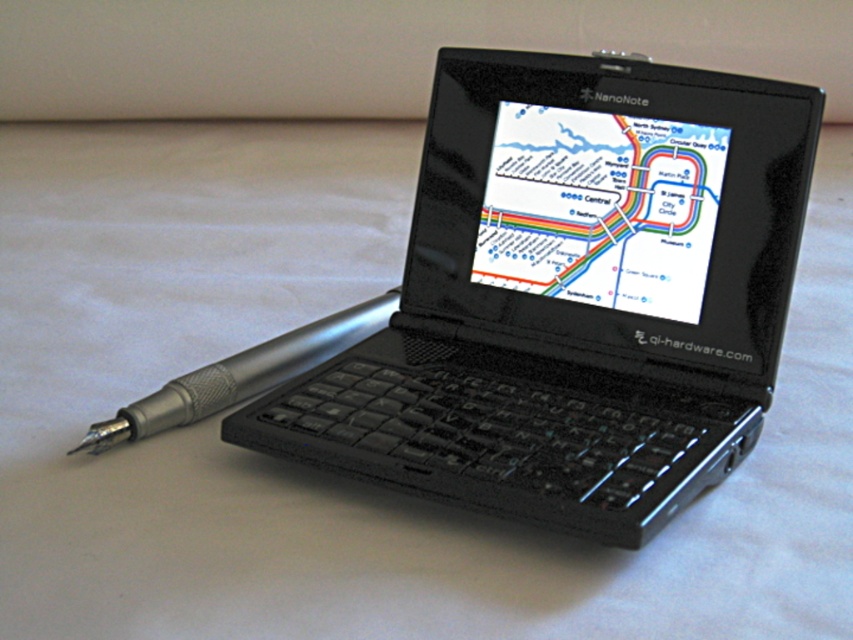
Is black matte laptop at center bigger than matte plastic map at center?

Correct, black matte laptop at center is larger in size than matte plastic map at center.

Is black matte laptop at center taller than matte plastic map at center?

Indeed, black matte laptop at center has a greater height compared to matte plastic map at center.

This screenshot has width=853, height=640. Identify the location of black matte laptop at center. (572, 294).

Who is lower down, black matte laptop at center or silver metallic pen at left?

silver metallic pen at left is lower down.

Between point (567, 300) and point (306, 349), which one is positioned behind?

Point (306, 349)

Is point (628, 444) in front of point (120, 426)?

Yes, it is.

Locate an element on the screen. The width and height of the screenshot is (853, 640). black matte laptop at center is located at coordinates (572, 294).

Measure the distance from matte plastic map at center to silver metallic pen at left.

matte plastic map at center is 12.97 inches away from silver metallic pen at left.

Which is behind, point (694, 252) or point (175, 394)?

The point (694, 252) is more distant.

Where is `matte plastic map at center`? This screenshot has height=640, width=853. matte plastic map at center is located at coordinates (601, 209).

Image resolution: width=853 pixels, height=640 pixels. Find the location of `matte plastic map at center`. matte plastic map at center is located at coordinates (601, 209).